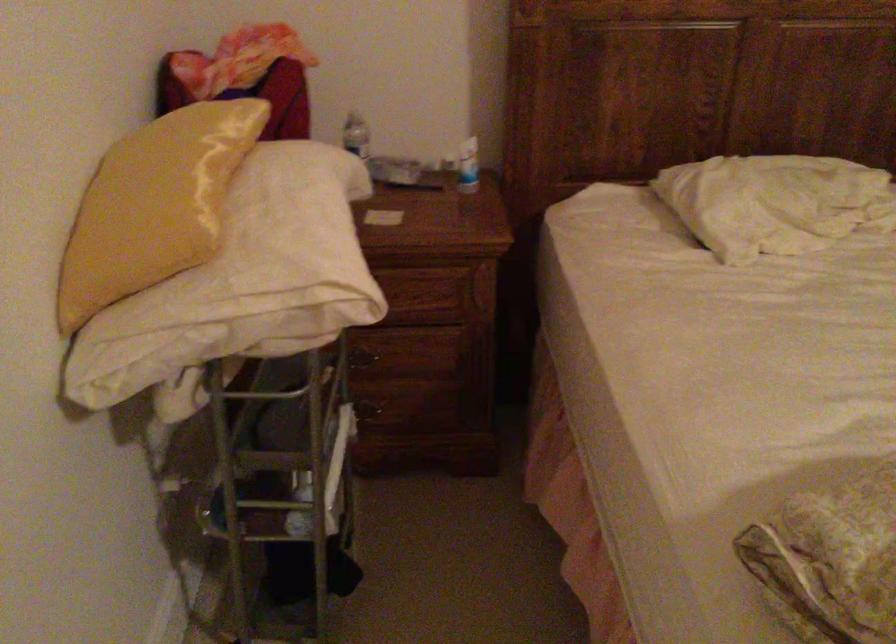
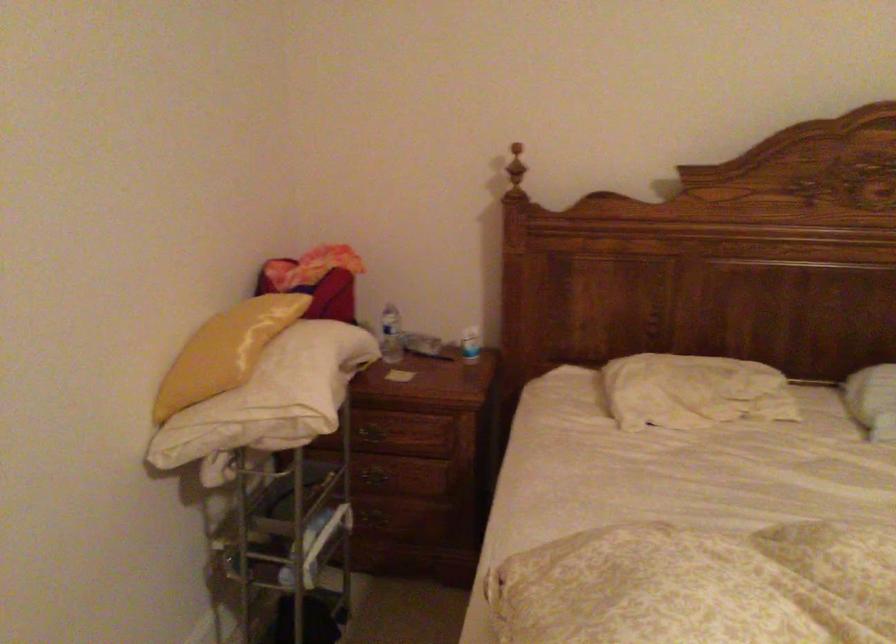
The point at (369,404) is marked in the first image. Where is the corresponding point in the second image?

(381, 516)